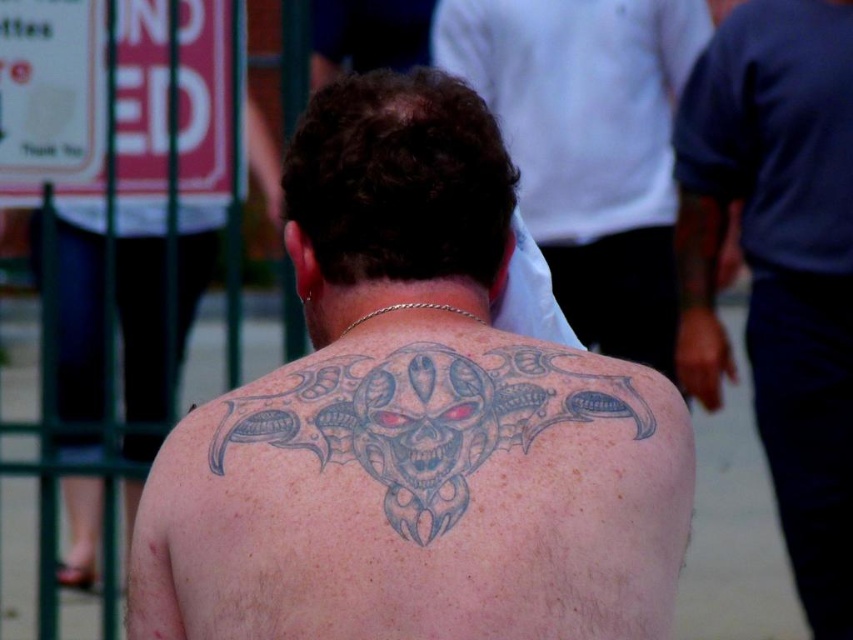
Question: Estimate the real-world distances between objects in this image. Which object is closer to the gray tattooed skin at center?

Choices:
 (A) gray tattooed back at center
 (B) gray/black tattoo at upper center

Answer: (B)

Question: Is the position of dark blue shirt at right less distant than that of gray/black tattoo at upper center?

Choices:
 (A) no
 (B) yes

Answer: (A)

Question: Is gray tattooed skin at center to the left of dark blue shirt at right from the viewer's perspective?

Choices:
 (A) no
 (B) yes

Answer: (B)

Question: Which point is farther to the camera?

Choices:
 (A) (694, 182)
 (B) (524, 100)
 (C) (549, 346)
 (D) (624, 376)

Answer: (B)

Question: Is gray tattooed skin at center thinner than dark blue shirt at right?

Choices:
 (A) no
 (B) yes

Answer: (A)

Question: Among these objects, which one is nearest to the camera?

Choices:
 (A) gray/black tattoo at upper center
 (B) gray tattooed back at center

Answer: (A)